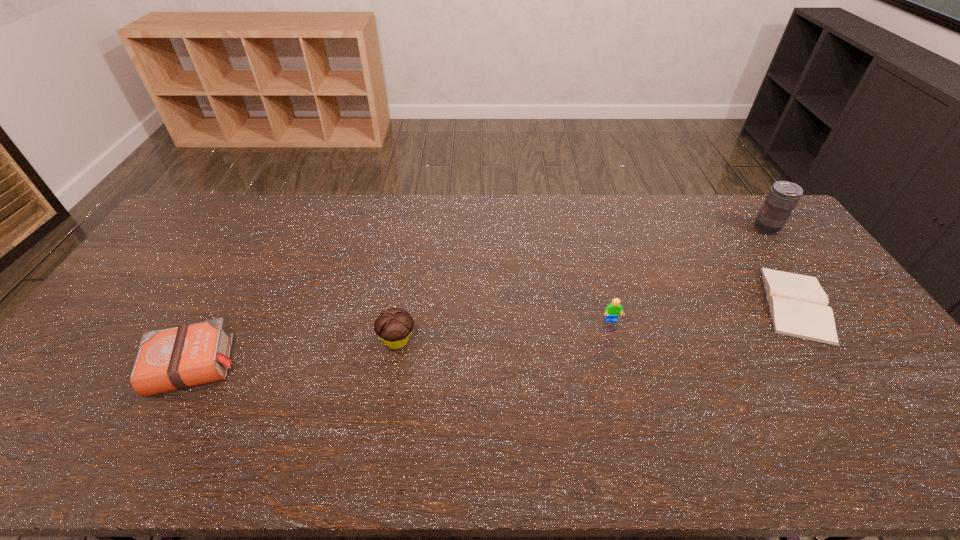
The width and height of the screenshot is (960, 540). In the image, there is a desktop. What are the coordinates of `vacant space at the near edge` in the screenshot? It's located at (681, 467).

Find the location of a particular element. The height and width of the screenshot is (540, 960). free region at the right edge of the desktop is located at coordinates (786, 272).

Identify the location of vacant space at the near right corner of the desktop. (948, 454).

Identify the location of free space that is in between the Lego and the tallest object. (688, 275).

The width and height of the screenshot is (960, 540). Identify the location of empty location between the third object from right to left and the second object from left to right. (504, 330).

Locate an element on the screen. vacant area that lies between the left Bible and the fourth object from right to left is located at coordinates (295, 353).

Where is `free space between the fourth object from right to left and the leftmost object`? free space between the fourth object from right to left and the leftmost object is located at coordinates (295, 353).

Identify the location of free space that is in between the second object from left to right and the shortest object. Image resolution: width=960 pixels, height=540 pixels. (597, 322).

The width and height of the screenshot is (960, 540). What are the coordinates of `free spot between the shortest object and the fourth object from right to left` in the screenshot? It's located at (597, 322).

Find the location of a particular element. free spot between the Lego and the muffin is located at coordinates (504, 330).